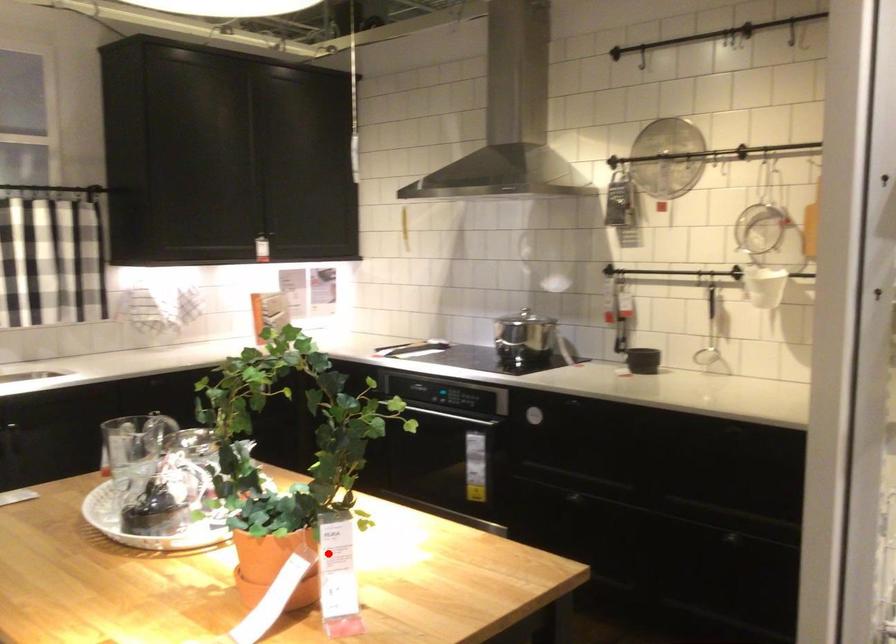
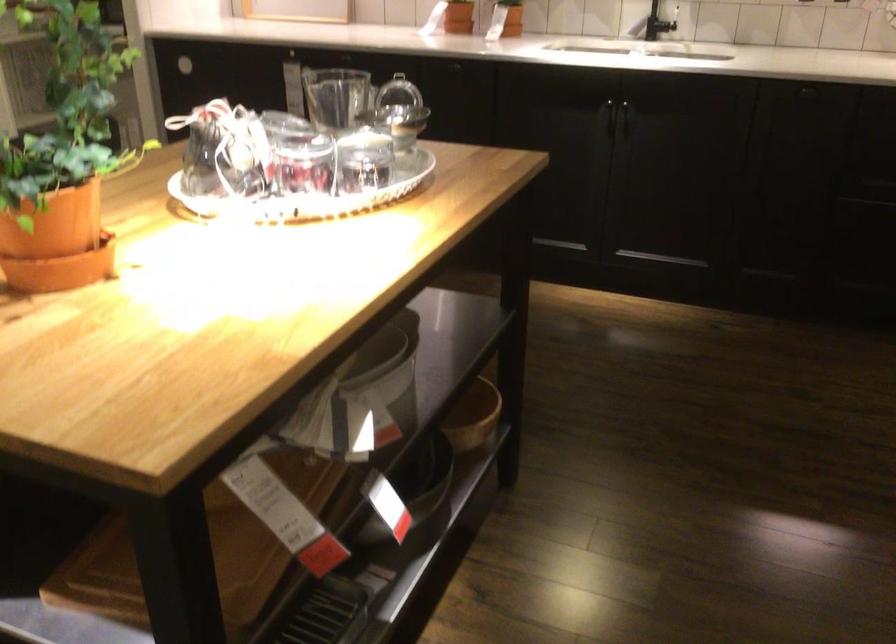
In the second image, find the point that corresponds to the highlighted location in the first image.

(57, 239)